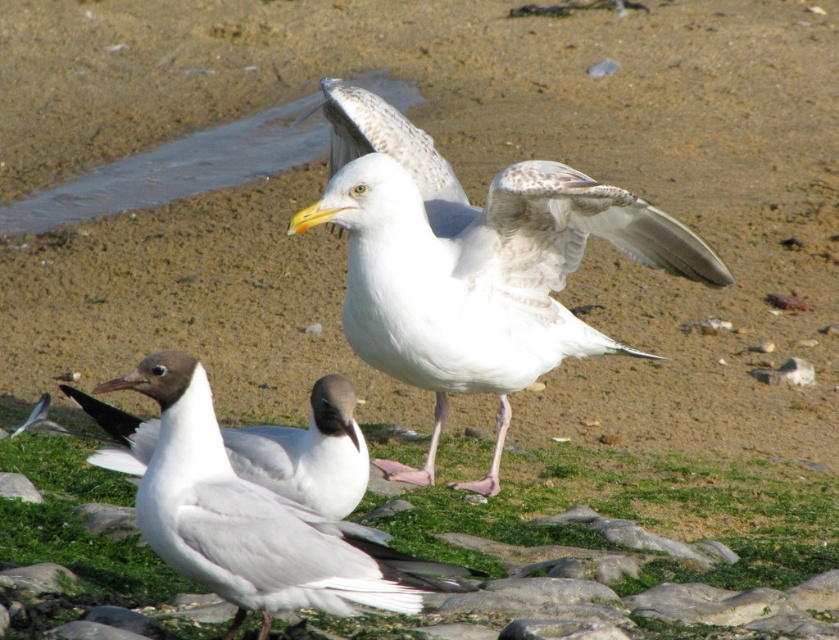
Question: Observing the image, what is the correct spatial positioning of white matte bird at center in reference to white matte/glossy seagull at center?

Choices:
 (A) right
 (B) left

Answer: (A)

Question: Which point is farther to the camera?

Choices:
 (A) green grass at center
 (B) white feathered bird at center

Answer: (B)

Question: Is white feathered bird at center below white matte bird at center?

Choices:
 (A) no
 (B) yes

Answer: (A)

Question: Which object is closer to the camera taking this photo?

Choices:
 (A) white matte bird at center
 (B) white feathered bird at center
 (C) white matte/glossy seagull at center

Answer: (A)

Question: Which object appears closest to the camera in this image?

Choices:
 (A) white matte bird at center
 (B) white feathered bird at center
 (C) green grass at center

Answer: (A)

Question: Can you confirm if white feathered bird at center is smaller than white matte bird at center?

Choices:
 (A) no
 (B) yes

Answer: (A)